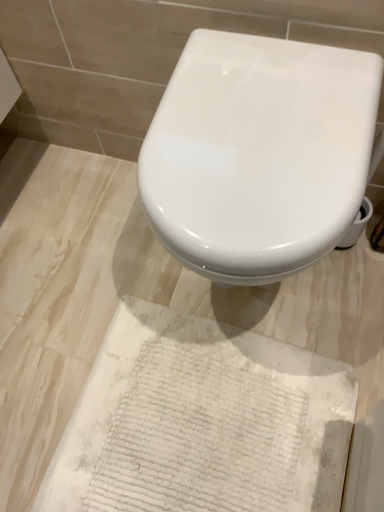
Identify the location of free point above white glossy toilet at center (from a real-world perspective). The image size is (384, 512). (251, 120).